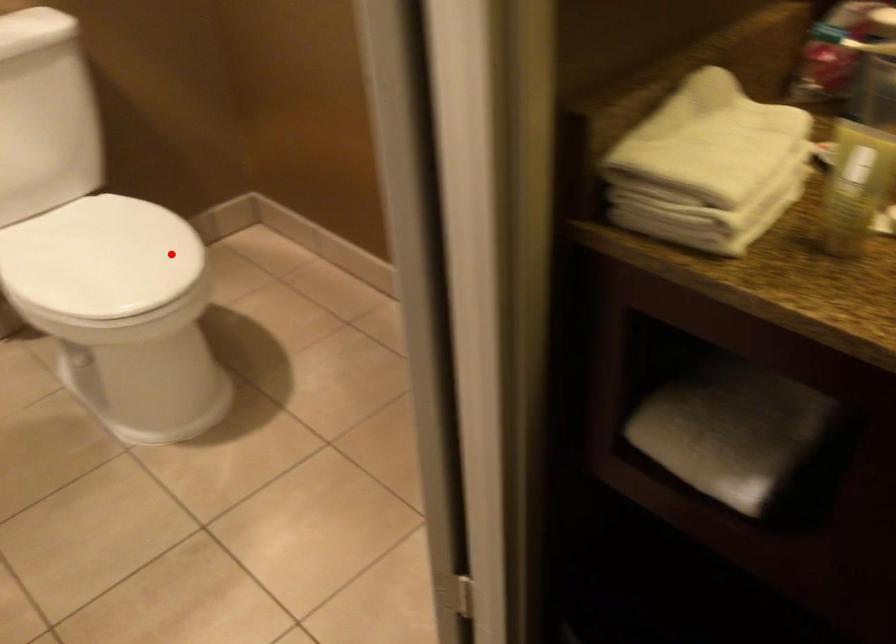
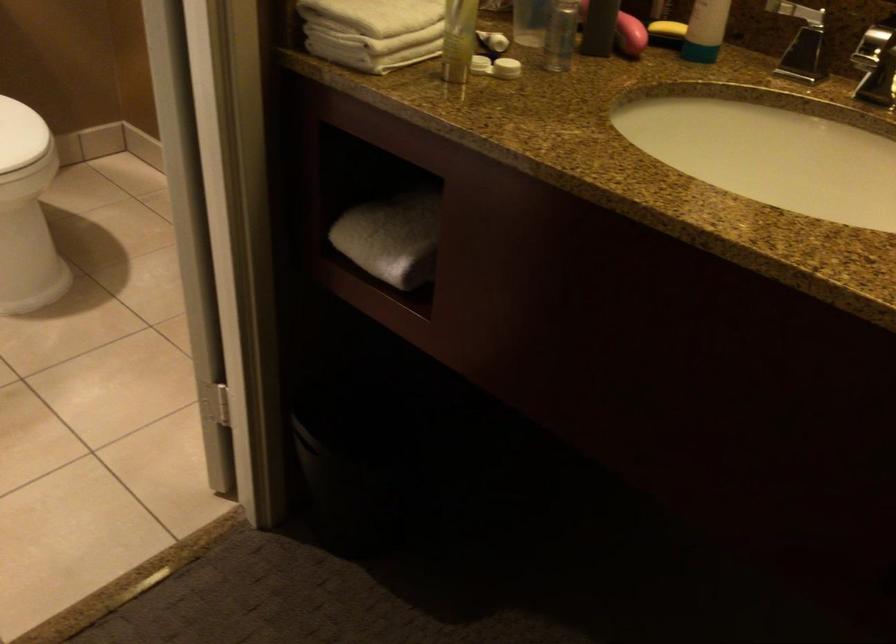
Find the pixel in the second image that matches the highlighted location in the first image.

(20, 135)